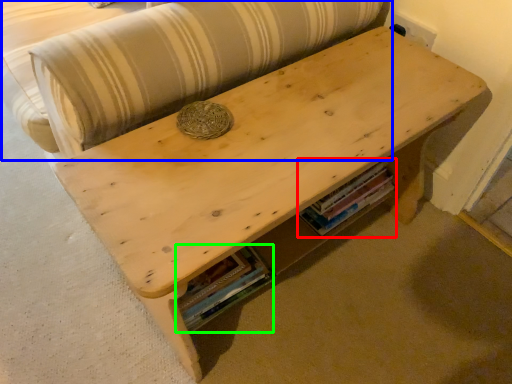
Question: Estimate the real-world distances between objects in this image. Which object is closer to book (highlighted by a red box), couch (highlighted by a blue box) or book (highlighted by a green box)?

Choices:
 (A) couch
 (B) book

Answer: (B)